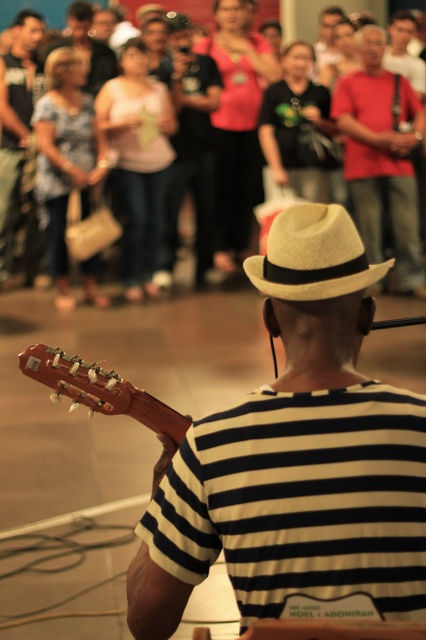
Can you confirm if white straw hat at center is positioned to the left of matte black shirt at upper left?

Incorrect, white straw hat at center is not on the left side of matte black shirt at upper left.

Who is shorter, white straw hat at center or matte black shirt at upper left?

Standing shorter between the two is white straw hat at center.

The image size is (426, 640). Describe the element at coordinates (296, 460) in the screenshot. I see `white straw hat at center` at that location.

Locate an element on the screen. Image resolution: width=426 pixels, height=640 pixels. white straw hat at center is located at coordinates (296, 460).

Does white straw hat at center have a greater height compared to black matte shirt at center?

Incorrect, white straw hat at center's height is not larger of black matte shirt at center's.

Does white straw hat at center have a lesser width compared to black matte shirt at center?

Yes, white straw hat at center is thinner than black matte shirt at center.

Does point (313, 452) come closer to viewer compared to point (270, 160)?

Yes, it is in front of point (270, 160).

The image size is (426, 640). Find the location of `white straw hat at center`. white straw hat at center is located at coordinates (296, 460).

Which of these two, white straw hat at center or woolen fedora at center, stands shorter?

woolen fedora at center

Can you confirm if white straw hat at center is bigger than woolen fedora at center?

Yes, white straw hat at center is bigger than woolen fedora at center.

Find the location of a particular element. white straw hat at center is located at coordinates (296, 460).